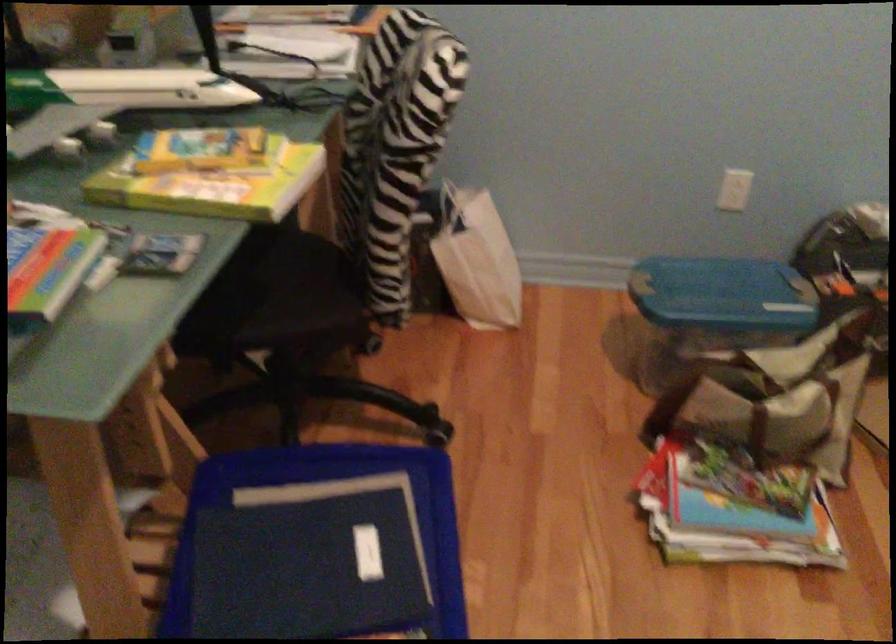
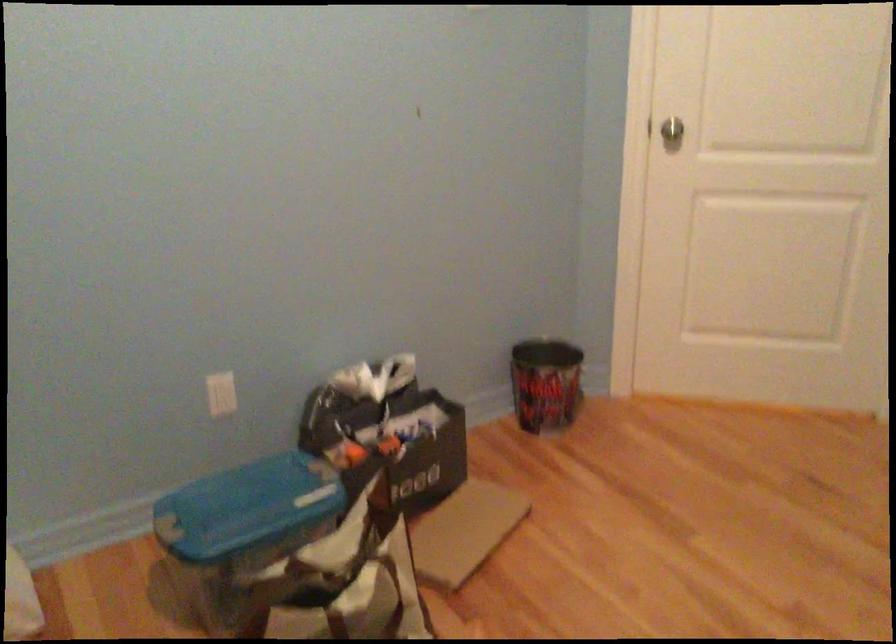
Find the pixel in the second image that matches (x=720, y=290) in the first image.

(247, 507)